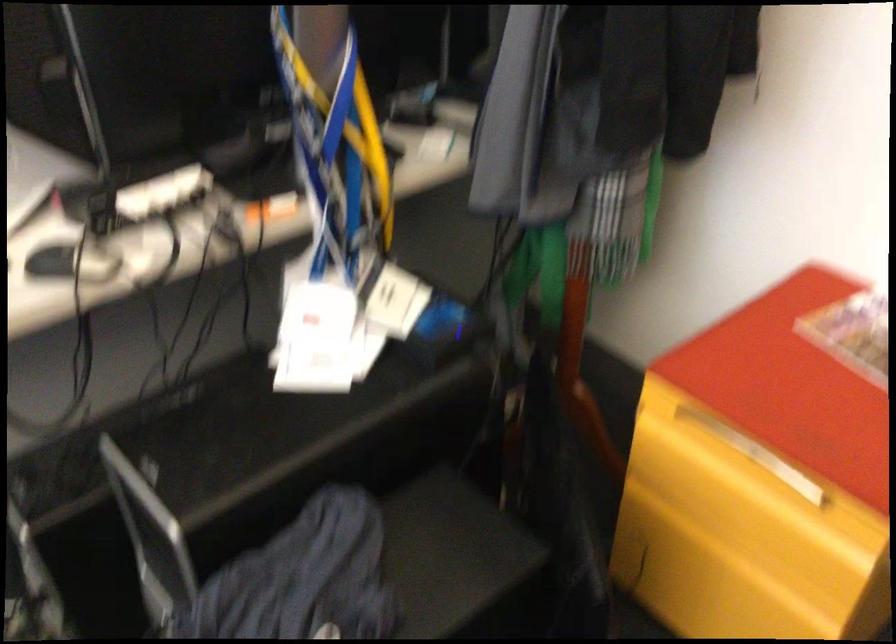
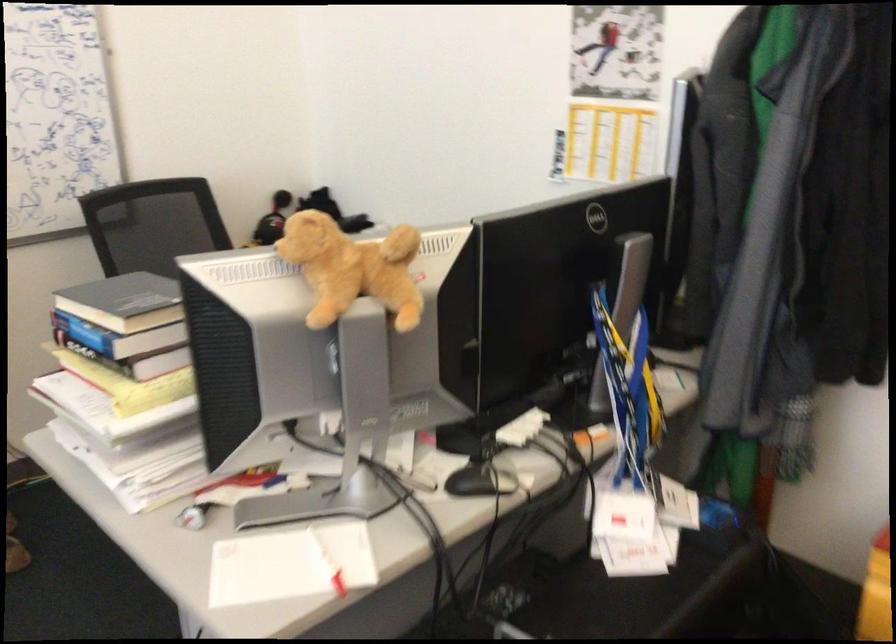
Question: The images are taken continuously from a first-person perspective. In which direction is your viewpoint rotating?

Choices:
 (A) Left
 (B) Right
 (C) Up
 (D) Down

Answer: (C)